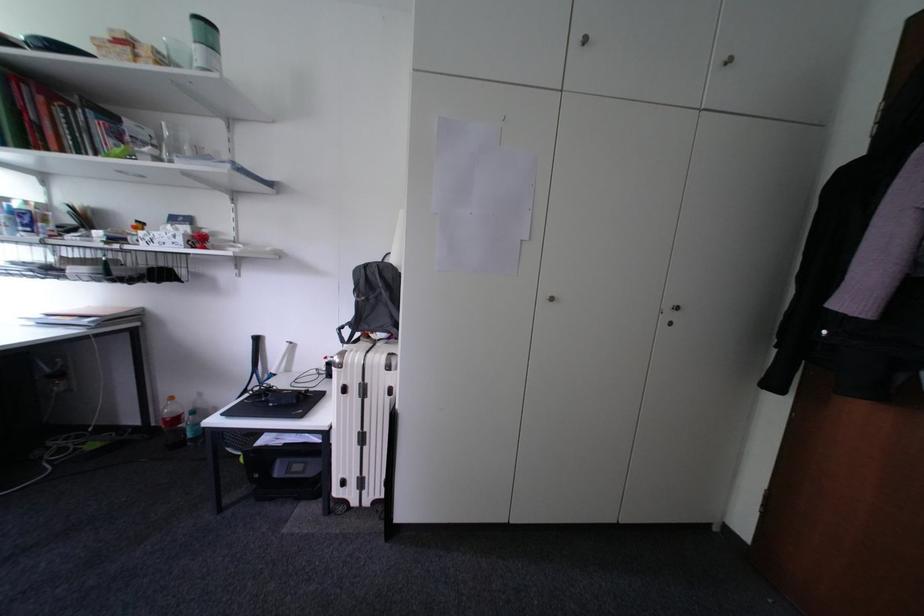
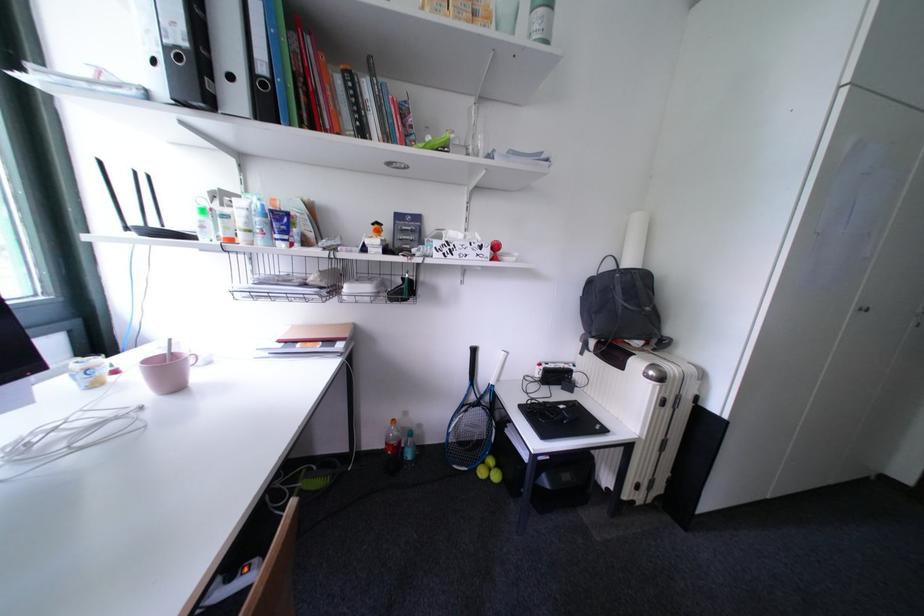
Question: Which direction would the cameraman need to move to produce the second image? Reply with the corresponding letter.

Choices:
 (A) Left
 (B) Right
 (C) Forward
 (D) Backward

Answer: (A)